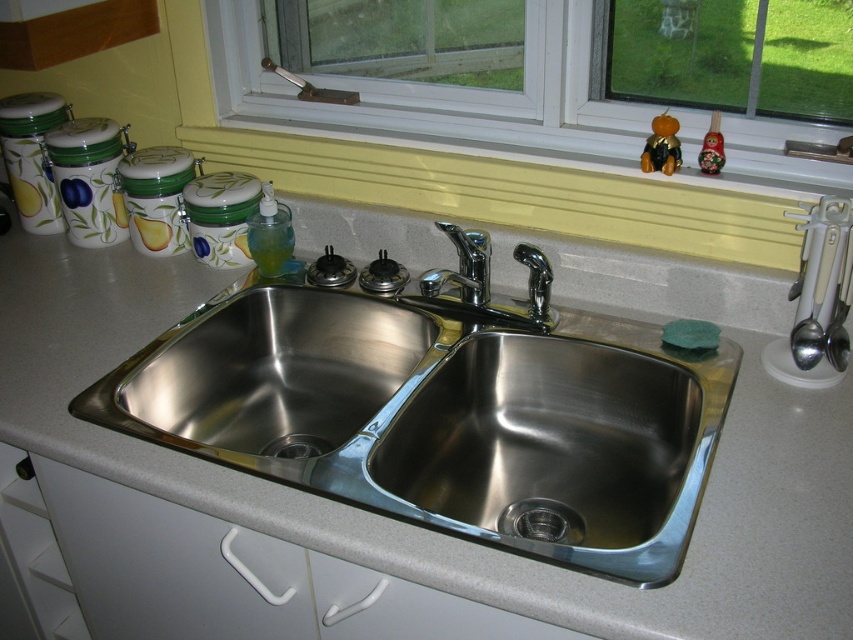
Image resolution: width=853 pixels, height=640 pixels. Identify the location of stainless steel sink at center. (442, 417).

Is stainless steel sink at center to the right of chrome/metallic faucet at center from the viewer's perspective?

No, stainless steel sink at center is not to the right of chrome/metallic faucet at center.

Does point (230, 339) come farther from viewer compared to point (457, 253)?

Yes, point (230, 339) is behind point (457, 253).

Identify the location of stainless steel sink at center. (442, 417).

Based on the photo, is stainless steel sink at center taller than white plastic window at upper center?

Correct, stainless steel sink at center is much taller as white plastic window at upper center.

Who is shorter, stainless steel sink at center or white plastic window at upper center?

Standing shorter between the two is white plastic window at upper center.

Does point (178, 429) come farther from viewer compared to point (828, 38)?

Yes, point (178, 429) is behind point (828, 38).

You are a GUI agent. You are given a task and a screenshot of the screen. Output one action in this format:
    pyautogui.click(x=<x>, y=<y>)
    Task: Click on the stainless steel sink at center
    This screenshot has height=640, width=853.
    Given the screenshot: What is the action you would take?
    pyautogui.click(x=442, y=417)

Does stainless steel sink at center have a smaller size compared to yellow painted wood at upper center?

No.

Does point (672, 428) come closer to viewer compared to point (415, 193)?

Yes, it is in front of point (415, 193).

Image resolution: width=853 pixels, height=640 pixels. I want to click on stainless steel sink at center, so click(x=442, y=417).